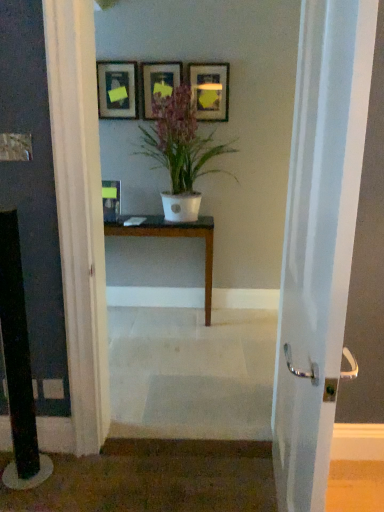
Where is `free spot to the right of dark brown wood table at center`? This screenshot has width=384, height=512. free spot to the right of dark brown wood table at center is located at coordinates (231, 330).